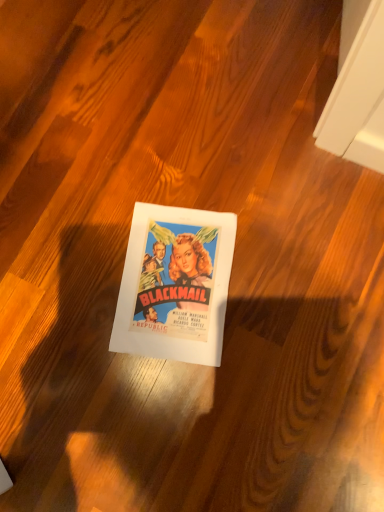
I want to click on free point behind white paper poster at center, so click(x=149, y=172).